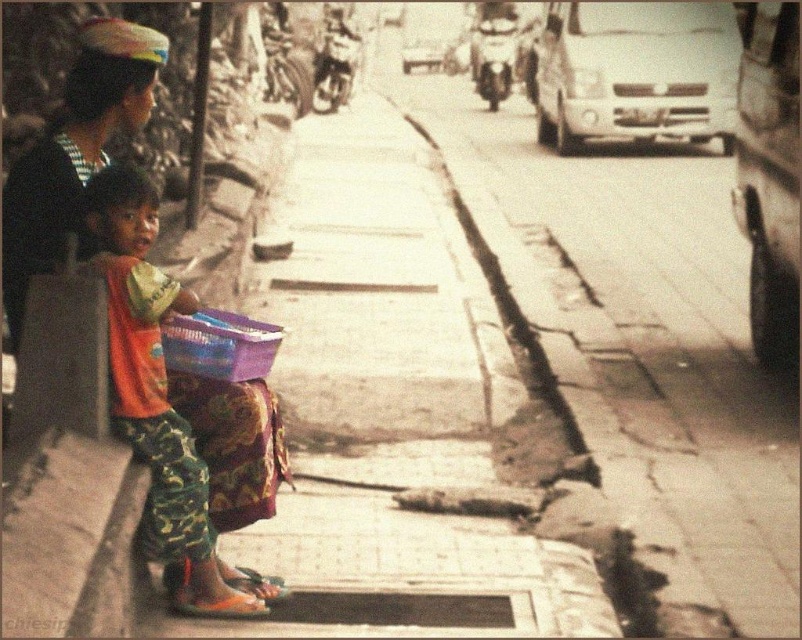
You are a delivery person carrying a package and need to place it on the smooth concrete pavement at center and the purple woven basket at lower center. Which surface is more to the right?

The smooth concrete pavement at center is positioned on the right side of the purple woven basket at lower center, so the smooth concrete pavement at center is more to the right.

You are a delivery person trying to place a package on the ground between the smooth concrete pavement at center and the camouflage pants at left. Which surface should you choose to ensure the package remains stable?

The smooth concrete pavement at center has a greater height compared to the camouflage pants at left, so placing the package on the smooth concrete pavement at center will provide a more stable surface.

Looking at this image, you are a delivery person trying to place a large package on the sidewalk. The package is as wide as the smooth concrete pavement at center. Can the camouflage pants at left fit on the same pavement without overlapping?

The smooth concrete pavement at center has a larger width than the camouflage pants at left, so yes, the camouflage pants at left can fit on the smooth concrete pavement at center without overlapping.